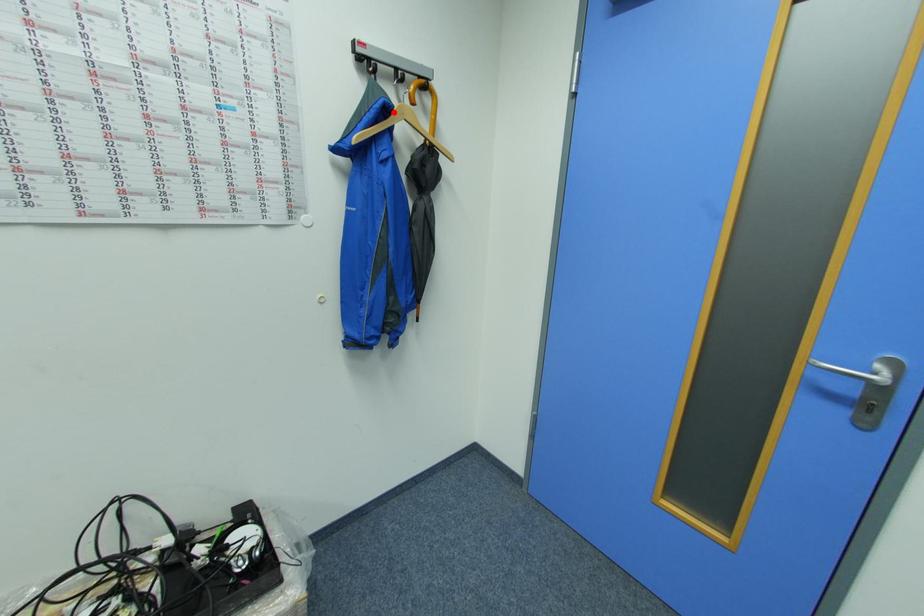
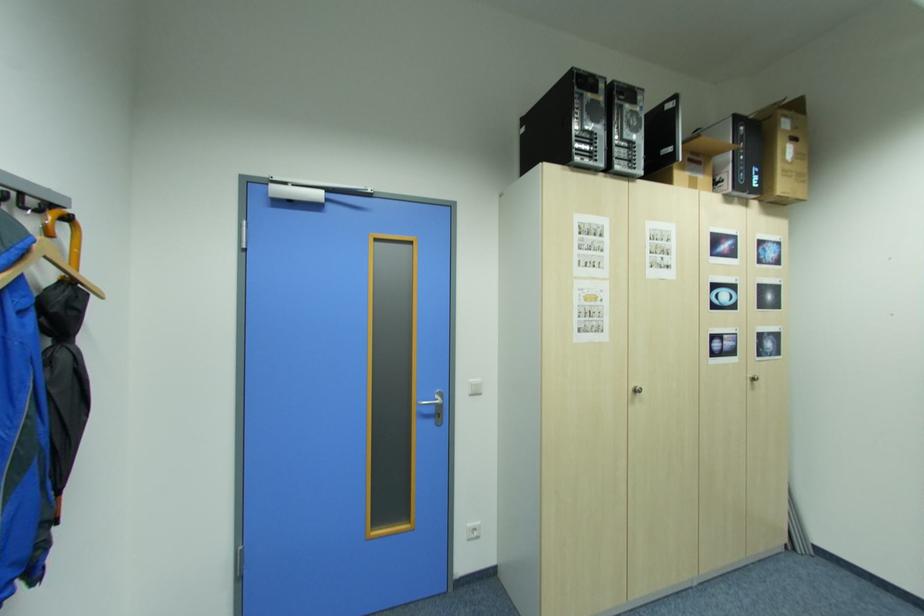
Find the pixel in the second image that matches the highlighted location in the first image.

(35, 251)